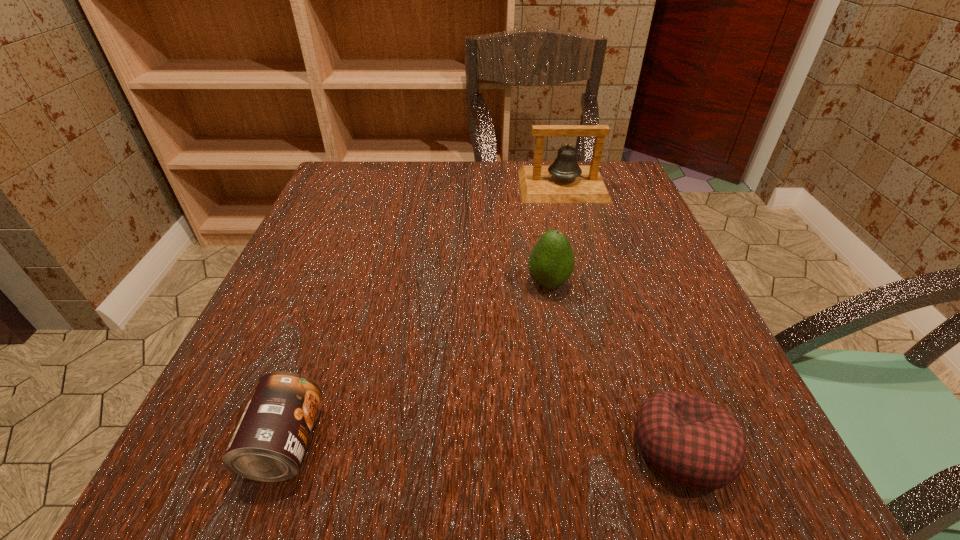
Image resolution: width=960 pixels, height=540 pixels. Identify the location of object that is at the far edge. (564, 181).

This screenshot has height=540, width=960. What are the coordinates of `can that is at the near edge` in the screenshot? It's located at (268, 445).

Identify the location of beanbag that is positioned at the near edge. (693, 442).

What are the coordinates of `object that is at the left edge` in the screenshot? It's located at (268, 445).

Where is `bell at the right edge`? bell at the right edge is located at coordinates (564, 181).

Identify the location of beanbag that is at the right edge. (693, 442).

This screenshot has height=540, width=960. In order to click on object present at the near left corner in this screenshot , I will do `click(268, 445)`.

What are the coordinates of `object present at the far right corner` in the screenshot? It's located at click(564, 181).

You are a GUI agent. You are given a task and a screenshot of the screen. Output one action in this format:
    pyautogui.click(x=<x>, y=<y>)
    Task: Click on the object that is at the near right corner
    The image size is (960, 540).
    Given the screenshot: What is the action you would take?
    pyautogui.click(x=693, y=442)

Image resolution: width=960 pixels, height=540 pixels. Identify the location of free space at the near edge. (369, 501).